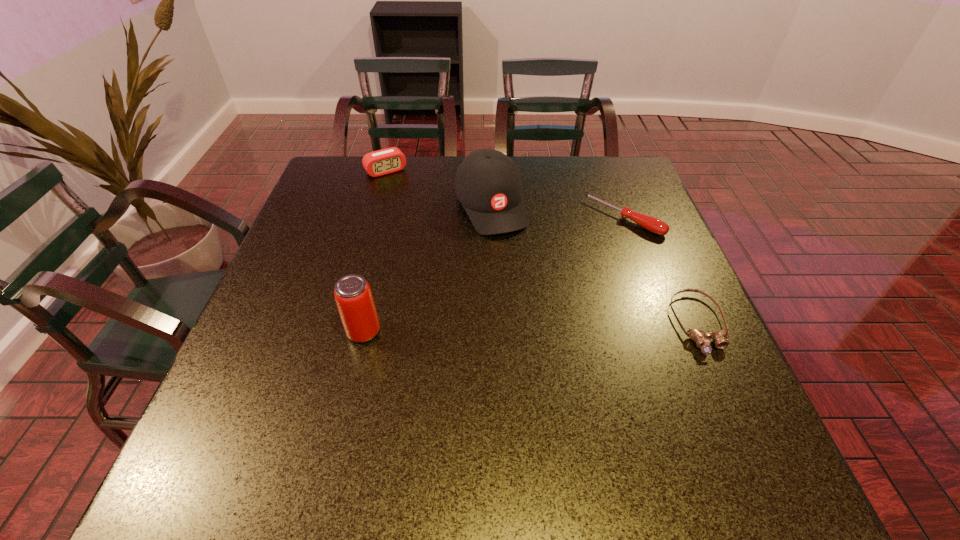
I want to click on goggles present at the right edge, so click(x=720, y=340).

At what (x,y) coordinates should I click in order to perform the action: click on screwdriver located in the right edge section of the desktop. Please return your answer as a coordinate pair (x, y). Image resolution: width=960 pixels, height=540 pixels. Looking at the image, I should click on (652, 224).

Find the location of a particular element. object at the far left corner is located at coordinates (389, 160).

Where is `object at the far right corner`? The height and width of the screenshot is (540, 960). object at the far right corner is located at coordinates (652, 224).

This screenshot has height=540, width=960. What are the coordinates of `free space at the far edge of the desktop` in the screenshot? It's located at (412, 174).

What are the coordinates of `vacant position at the near edge of the desktop` in the screenshot? It's located at (x=528, y=404).

Locate an element on the screen. free space at the left edge of the desktop is located at coordinates (324, 245).

Locate an element on the screen. The image size is (960, 540). free space at the right edge is located at coordinates (657, 380).

You are a GUI agent. You are given a task and a screenshot of the screen. Output one action in this format:
    pyautogui.click(x=<x>, y=<y>)
    Task: Click on the free region at the far left corner
    This screenshot has width=960, height=540.
    Given the screenshot: What is the action you would take?
    pyautogui.click(x=358, y=197)

This screenshot has width=960, height=540. What are the coordinates of `vacant position at the near left corner of the desktop` in the screenshot? It's located at (246, 392).